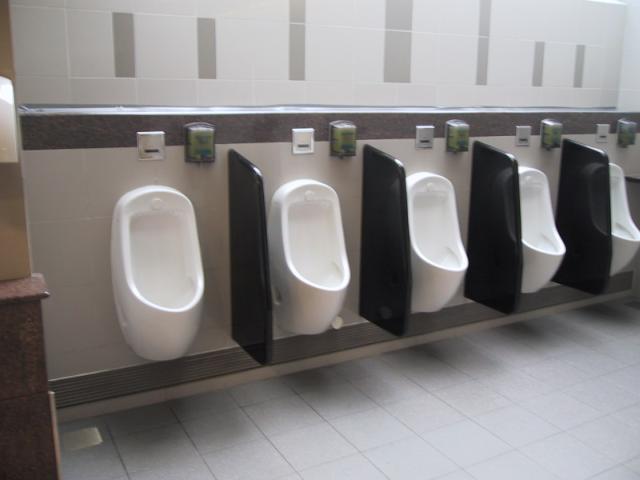
This screenshot has height=480, width=640. What are the coordinates of `men's room urinals'` in the screenshot? It's located at (173, 297), (324, 258), (422, 244), (634, 236), (532, 232).